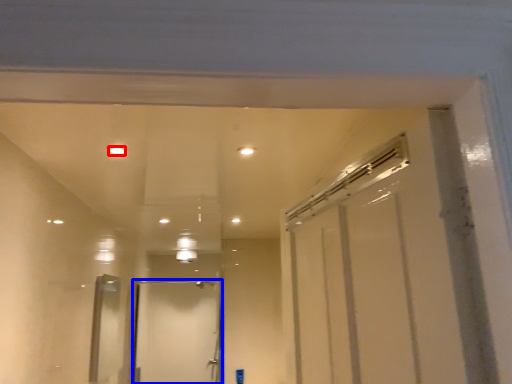
Question: Which point is further to the camera, light (highlighted by a red box) or door (highlighted by a blue box)?

Choices:
 (A) light
 (B) door

Answer: (B)